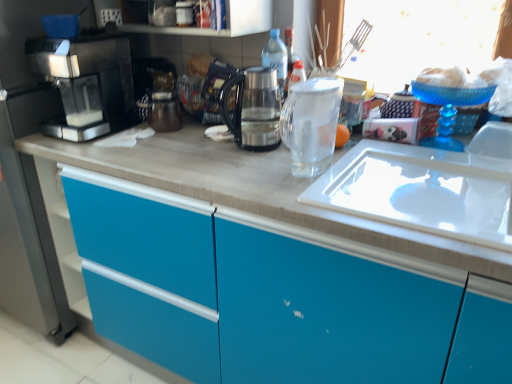
Identify the location of free space above matte white countertop at center (from a real-world perspective). (274, 158).